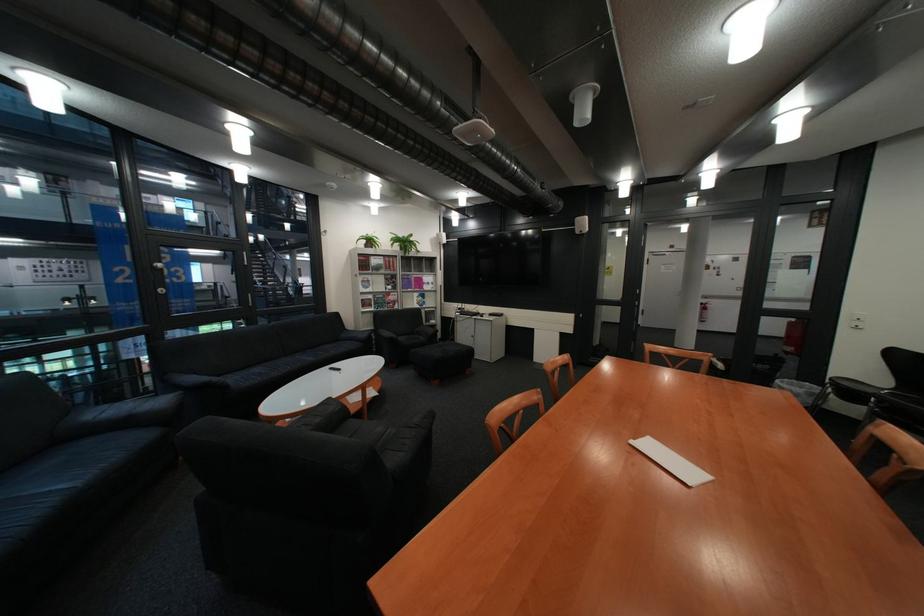
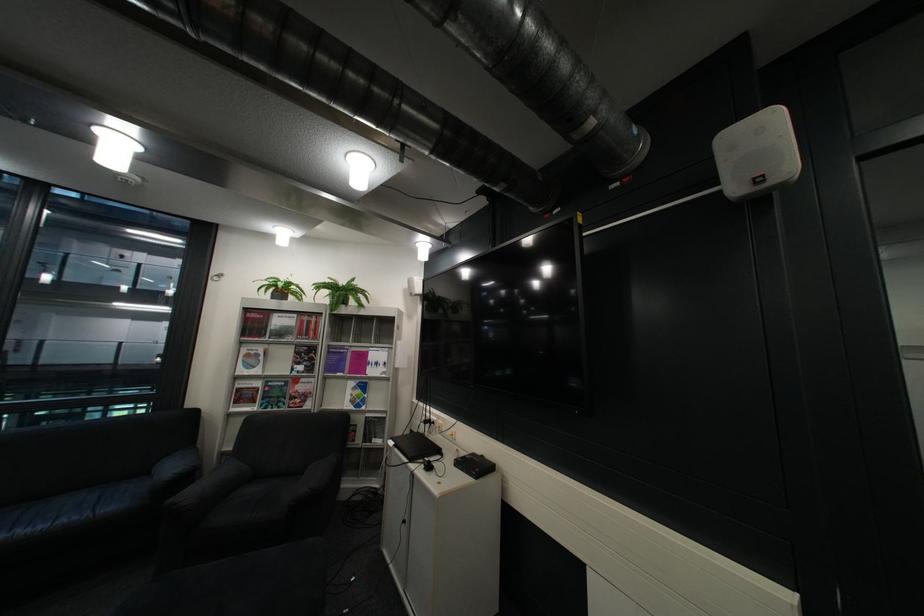
Locate, in the second image, the point that corresponds to (x=400, y=278) in the first image.

(311, 353)